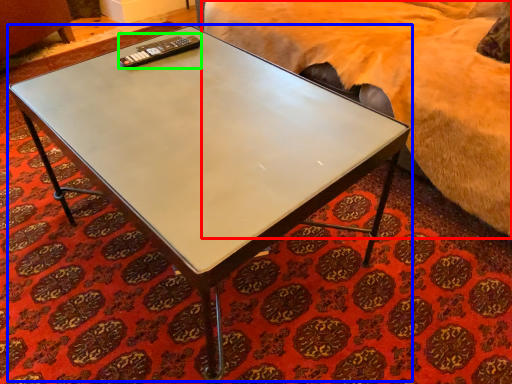
Question: Estimate the real-world distances between objects in this image. Which object is closer to bed (highlighted by a red box), coffee table (highlighted by a blue box) or remote (highlighted by a green box)?

Choices:
 (A) coffee table
 (B) remote

Answer: (A)